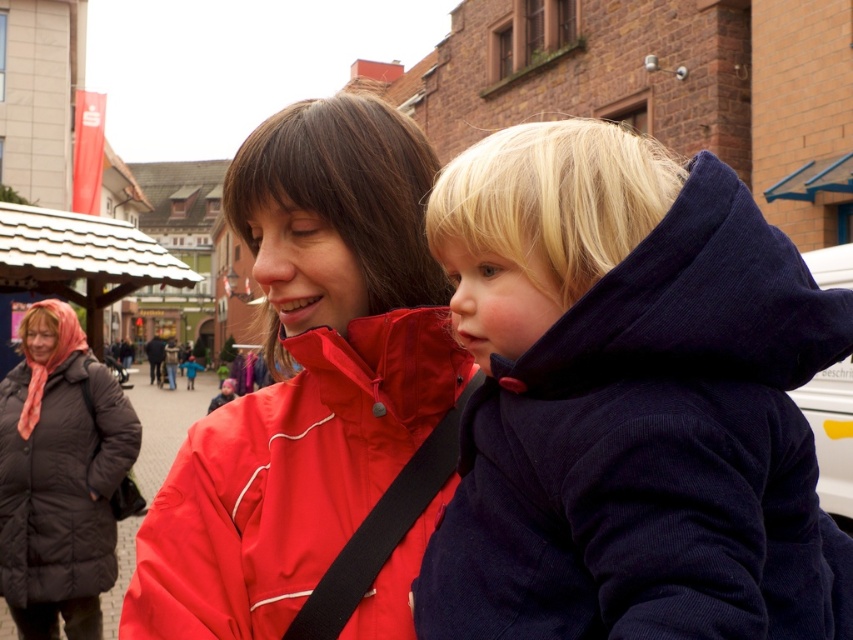
Question: Which of the following is the closest to the observer?

Choices:
 (A) navy corduroy jacket at center
 (B) black puffy coat at lower left

Answer: (A)

Question: Does matte red jacket at center have a lesser width compared to black puffy coat at lower left?

Choices:
 (A) no
 (B) yes

Answer: (A)

Question: Which point is farther from the camera taking this photo?

Choices:
 (A) (767, 227)
 (B) (119, 483)
 (C) (265, 433)

Answer: (B)

Question: Which point is farther to the camera?

Choices:
 (A) matte red jacket at center
 (B) navy corduroy jacket at center
 (C) black puffy coat at lower left

Answer: (C)

Question: Can you confirm if matte red jacket at center is positioned above black puffy coat at lower left?

Choices:
 (A) yes
 (B) no

Answer: (A)

Question: Is navy corduroy jacket at center below black puffy coat at lower left?

Choices:
 (A) yes
 (B) no

Answer: (B)